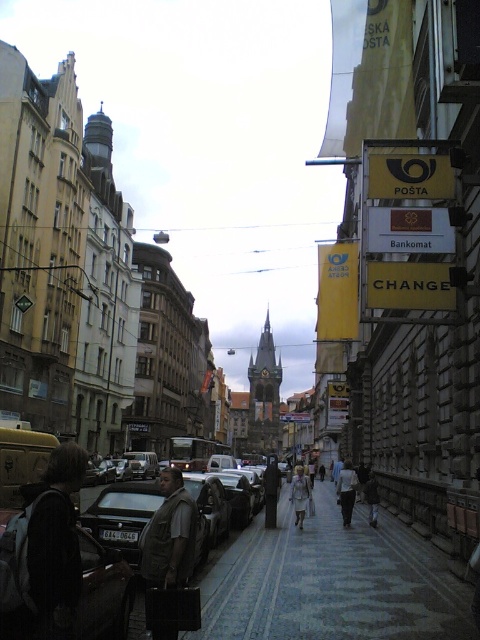
You are a fashion designer observing two outfits in the scene. The outfits are the light beige pants at center and the light gray fabric dress at center. Which outfit is smaller in size?

The light beige pants at center has a smaller size compared to the light gray fabric dress at center.